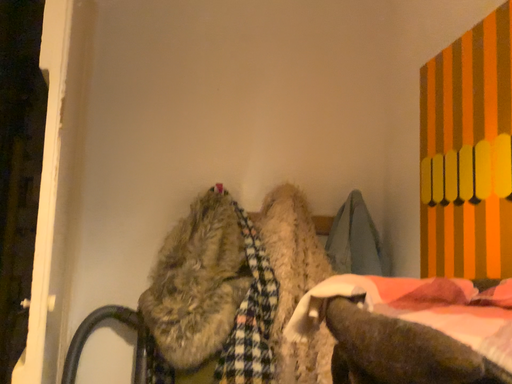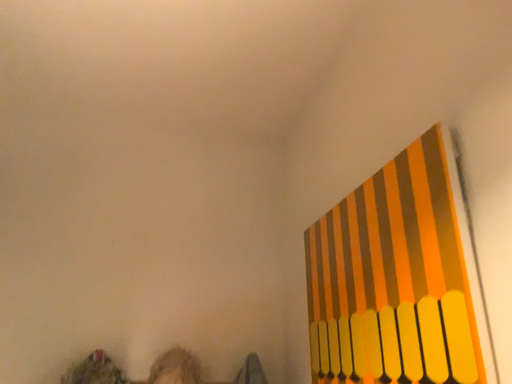
Question: How did the camera likely rotate when shooting the video?

Choices:
 (A) rotated left
 (B) rotated right

Answer: (B)